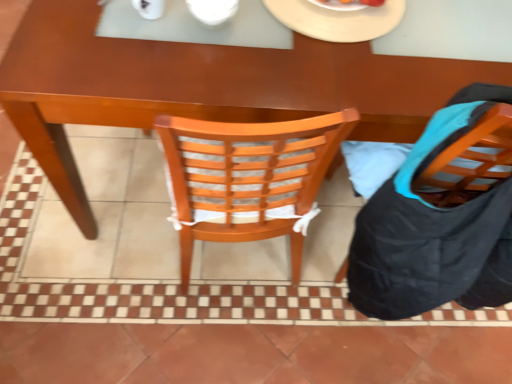
Question: Is white glossy bowl at upper center positioned far away from brown wooden desk at center?

Choices:
 (A) no
 (B) yes

Answer: (A)

Question: Can you confirm if white glossy bowl at upper center is bigger than brown wooden desk at center?

Choices:
 (A) no
 (B) yes

Answer: (A)

Question: Is white glossy bowl at upper center to the left of brown wooden desk at center from the viewer's perspective?

Choices:
 (A) no
 (B) yes

Answer: (B)

Question: Does white glossy bowl at upper center have a greater height compared to brown wooden desk at center?

Choices:
 (A) no
 (B) yes

Answer: (A)

Question: Is white glossy bowl at upper center oriented away from brown wooden desk at center?

Choices:
 (A) yes
 (B) no

Answer: (B)

Question: Can you confirm if white glossy bowl at upper center is positioned to the right of brown wooden desk at center?

Choices:
 (A) yes
 (B) no

Answer: (B)

Question: Is white glossy bowl at upper center positioned beyond the bounds of wooden chair at right?

Choices:
 (A) no
 (B) yes

Answer: (B)

Question: Can you confirm if white glossy bowl at upper center is positioned to the right of wooden chair at right?

Choices:
 (A) yes
 (B) no

Answer: (B)

Question: Is white glossy bowl at upper center turned away from wooden chair at right?

Choices:
 (A) no
 (B) yes

Answer: (A)

Question: Is white glossy bowl at upper center to the left of wooden chair at right from the viewer's perspective?

Choices:
 (A) no
 (B) yes

Answer: (B)

Question: Is white glossy bowl at upper center next to wooden chair at right and touching it?

Choices:
 (A) no
 (B) yes

Answer: (A)

Question: Is white glossy bowl at upper center far away from wooden chair at right?

Choices:
 (A) yes
 (B) no

Answer: (B)

Question: From a real-world perspective, is wooden chair at right under white matte plate at upper center?

Choices:
 (A) no
 (B) yes

Answer: (B)